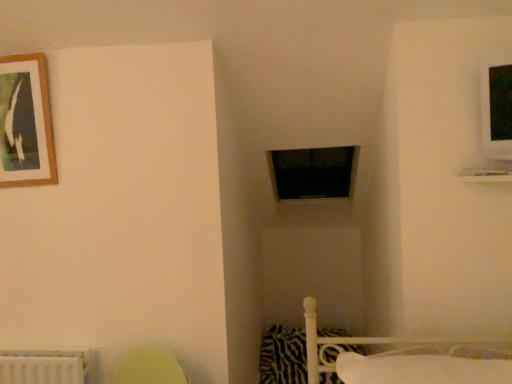
Question: Could you tell me if zebra-patterned fabric pillow at lower right, positioned as the 1th pillow in back-to-front order, is facing black matte window frame at center?

Choices:
 (A) no
 (B) yes

Answer: (A)

Question: Could black matte window frame at center be considered to be inside zebra-patterned fabric pillow at lower right, positioned as the 1th pillow in back-to-front order?

Choices:
 (A) yes
 (B) no

Answer: (B)

Question: From a real-world perspective, is zebra-patterned fabric pillow at lower right, which is the 2th pillow from front to back, located beneath black matte window frame at center?

Choices:
 (A) yes
 (B) no

Answer: (A)

Question: Is zebra-patterned fabric pillow at lower right, the 2th pillow viewed from the top, far away from black matte window frame at center?

Choices:
 (A) no
 (B) yes

Answer: (B)

Question: Can you confirm if zebra-patterned fabric pillow at lower right, the 2th pillow viewed from the top, is smaller than black matte window frame at center?

Choices:
 (A) yes
 (B) no

Answer: (A)

Question: Does zebra-patterned fabric pillow at lower right, the 2th pillow viewed from the top, appear on the left side of black matte window frame at center?

Choices:
 (A) yes
 (B) no

Answer: (A)

Question: Considering the relative positions of wooden-framed picture at upper left and black matte window frame at center in the image provided, is wooden-framed picture at upper left to the left of black matte window frame at center from the viewer's perspective?

Choices:
 (A) yes
 (B) no

Answer: (A)

Question: Does wooden-framed picture at upper left lie behind black matte window frame at center?

Choices:
 (A) no
 (B) yes

Answer: (A)

Question: From the image's perspective, is wooden-framed picture at upper left below black matte window frame at center?

Choices:
 (A) yes
 (B) no

Answer: (B)

Question: Is wooden-framed picture at upper left smaller than black matte window frame at center?

Choices:
 (A) yes
 (B) no

Answer: (A)

Question: Is wooden-framed picture at upper left oriented towards black matte window frame at center?

Choices:
 (A) no
 (B) yes

Answer: (A)

Question: Is wooden-framed picture at upper left in contact with black matte window frame at center?

Choices:
 (A) yes
 (B) no

Answer: (B)

Question: Is wooden-framed picture at upper left closer to camera compared to white soft pillow at lower right, marked as the first pillow in a front-to-back arrangement?

Choices:
 (A) yes
 (B) no

Answer: (B)